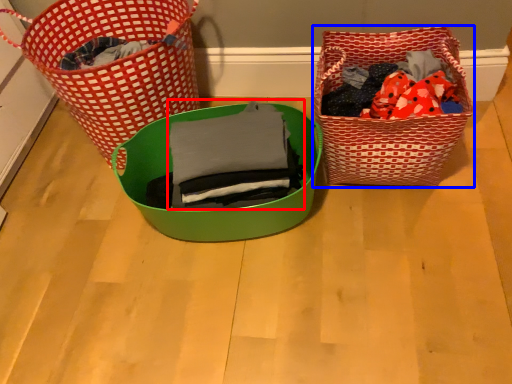
Question: Which of the following is the closest to the observer, clothing (highlighted by a red box) or picnic basket (highlighted by a blue box)?

Choices:
 (A) clothing
 (B) picnic basket

Answer: (A)